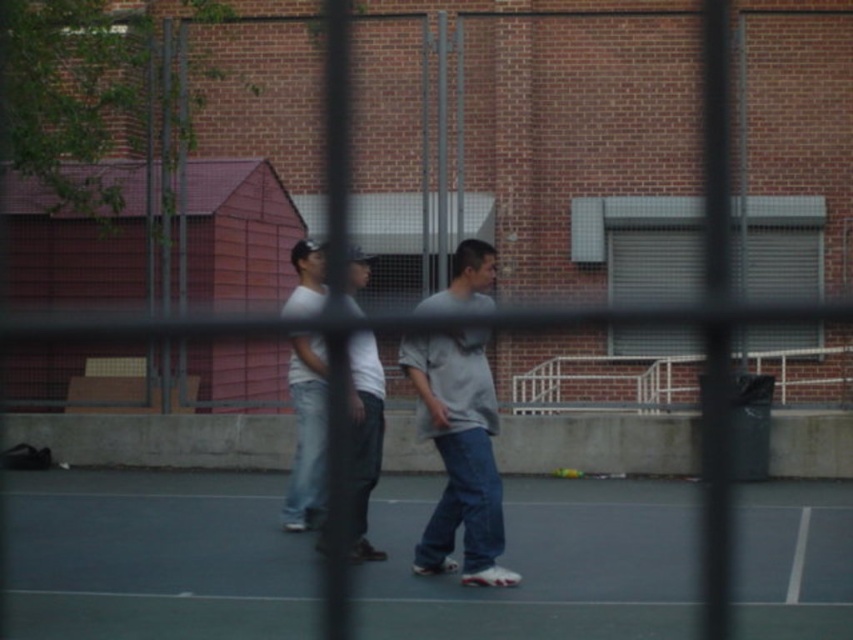
Is point (463, 92) positioned before point (798, 531)?

No, it is behind (798, 531).

Is metallic wire fence at center to the right of smooth gray court at center from the viewer's perspective?

In fact, metallic wire fence at center is to the left of smooth gray court at center.

This screenshot has width=853, height=640. Find the location of `metallic wire fence at center`. metallic wire fence at center is located at coordinates (x=529, y=147).

Can you confirm if gray matte shirt at center is wider than white matte t-shirt at center?

Correct, the width of gray matte shirt at center exceeds that of white matte t-shirt at center.

Based on the photo, is gray matte shirt at center above white matte t-shirt at center?

No, gray matte shirt at center is not above white matte t-shirt at center.

Is point (457, 384) positioned behind point (318, 369)?

No, (457, 384) is closer to viewer.

Identify the location of gray matte shirt at center. This screenshot has width=853, height=640. (459, 452).

Between point (196, 362) and point (370, 376), which one is positioned in front?

Point (370, 376) is in front.

Who is lower down, metallic wire fence at center or white matte shirt at center?

white matte shirt at center is lower down.

You are a GUI agent. You are given a task and a screenshot of the screen. Output one action in this format:
    pyautogui.click(x=<x>, y=<y>)
    Task: Click on the metallic wire fence at center
    The width and height of the screenshot is (853, 640).
    Given the screenshot: What is the action you would take?
    pyautogui.click(x=529, y=147)